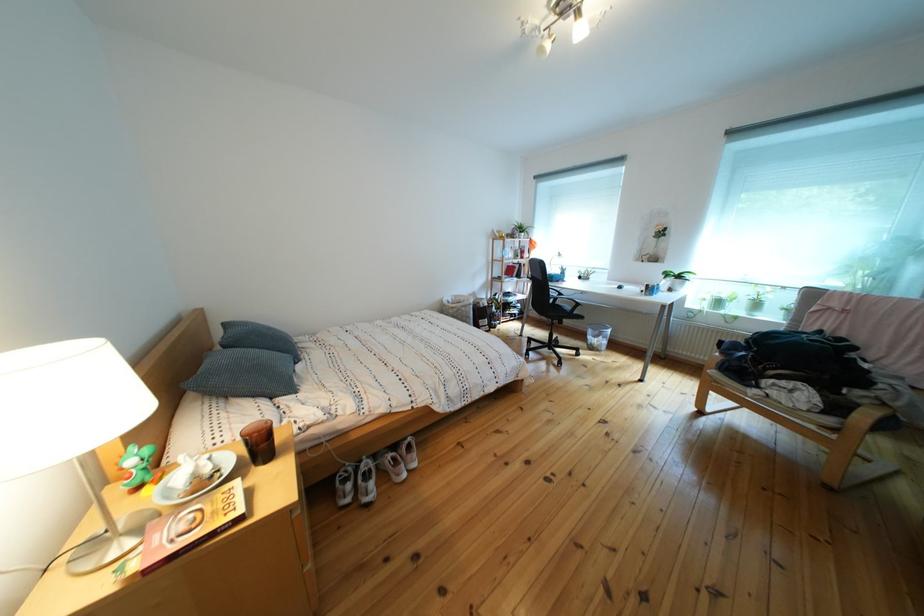
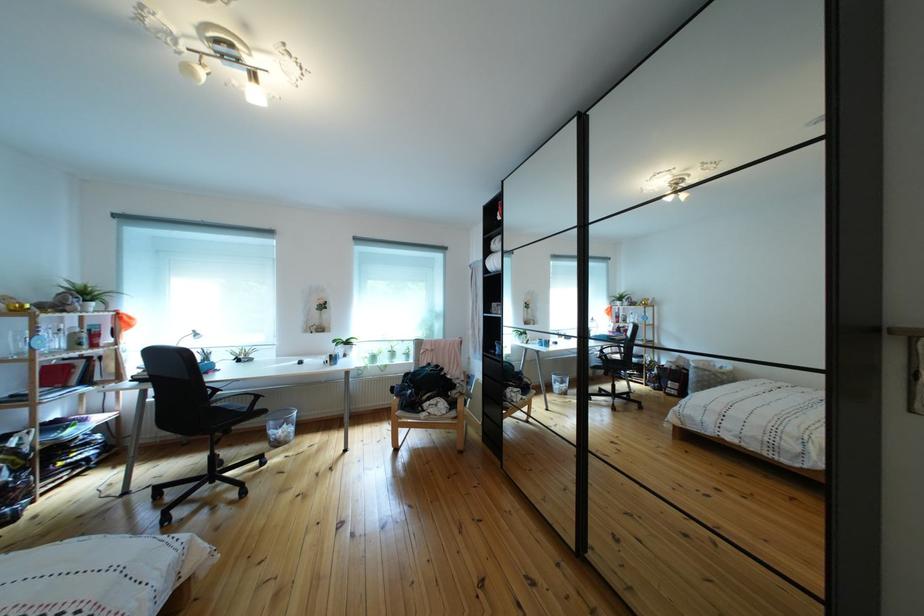
Question: The camera is either moving clockwise (left) or counter-clockwise (right) around the object. The first image is from the beginning of the video and the second image is from the end. Is the camera moving left or right when shooting the video?

Choices:
 (A) Left
 (B) Right

Answer: (A)